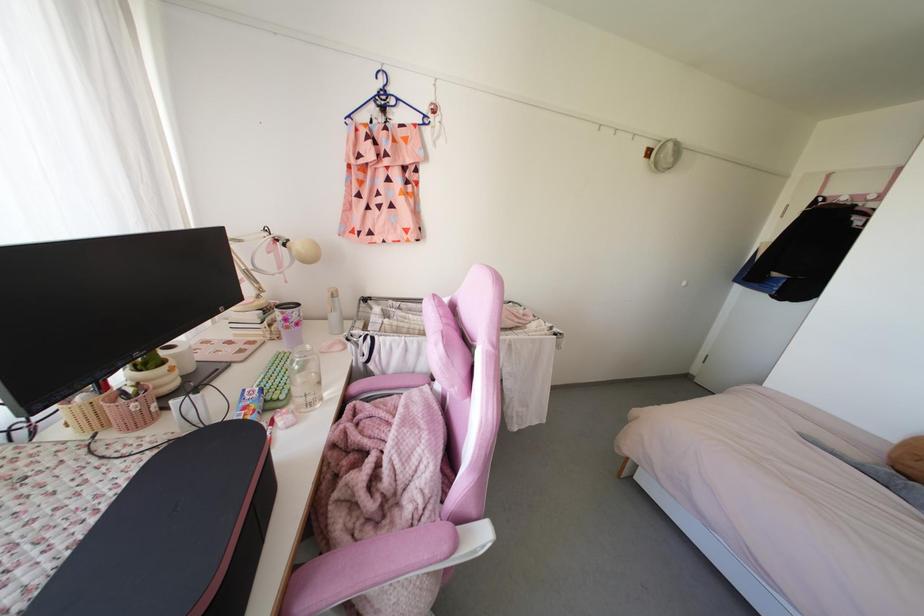
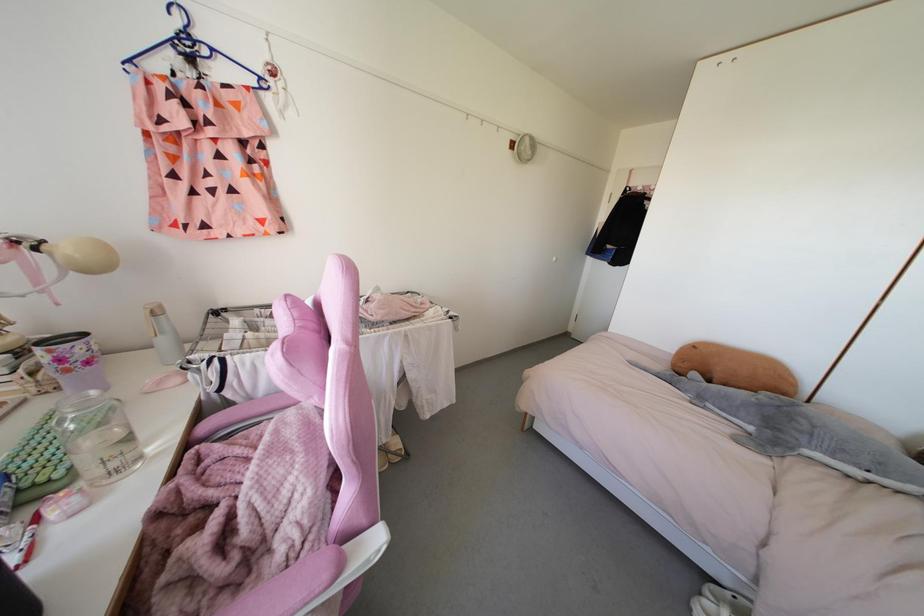
The point at (x=684, y=283) is marked in the first image. Where is the corresponding point in the second image?

(553, 257)